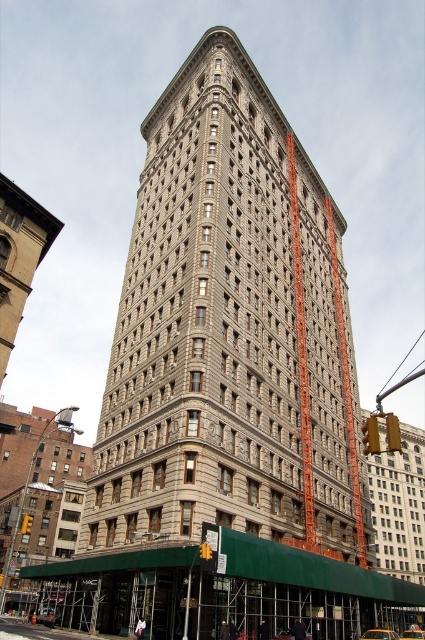
Question: Is the position of brick building at lower left more distant than that of beige stone building at lower left?

Choices:
 (A) no
 (B) yes

Answer: (B)

Question: Which object is closer to the camera taking this photo?

Choices:
 (A) brick building at lower left
 (B) beige stone building at lower left
 (C) matte gray building at lower right

Answer: (C)

Question: Which of the following is the farthest from the observer?

Choices:
 (A) (379, 472)
 (B) (2, 285)

Answer: (A)

Question: Where is brick building at lower left located in relation to matte gray building at lower right in the image?

Choices:
 (A) above
 (B) below

Answer: (B)

Question: Among these points, which one is nearest to the camera?

Choices:
 (A) (419, 460)
 (B) (27, 208)

Answer: (B)

Question: Can you confirm if brick building at lower left is bigger than matte gray building at lower right?

Choices:
 (A) no
 (B) yes

Answer: (B)